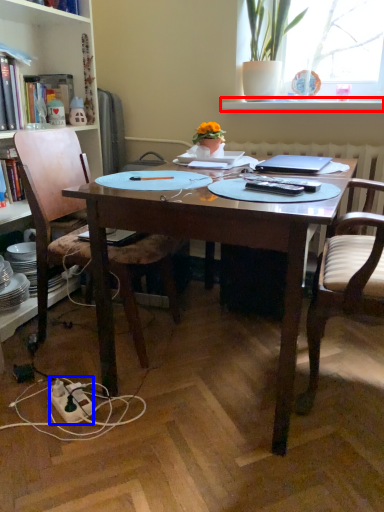
Question: Which object is closer to the camera taking this photo, window sill (highlighted by a red box) or power outlet (highlighted by a blue box)?

Choices:
 (A) window sill
 (B) power outlet

Answer: (B)